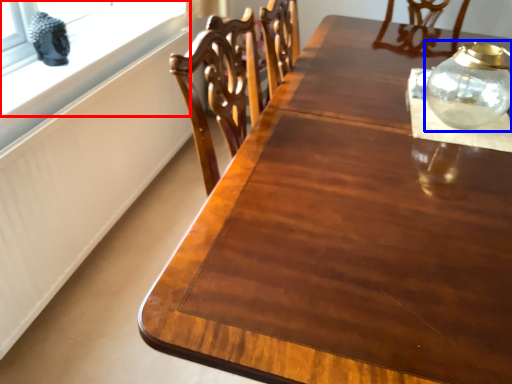
Question: Which object is further to the camera taking this photo, window (highlighted by a red box) or glass vase (highlighted by a blue box)?

Choices:
 (A) window
 (B) glass vase

Answer: (A)